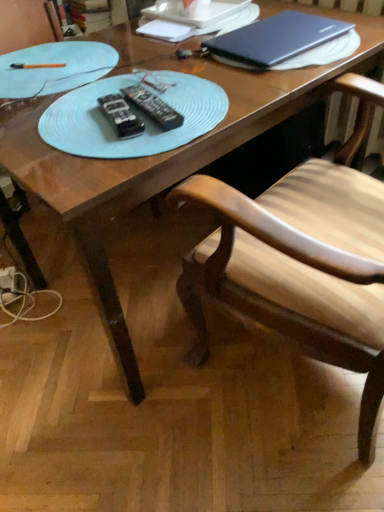
You are a GUI agent. You are given a task and a screenshot of the screen. Output one action in this format:
    pyautogui.click(x=<x>, y=<y>)
    Task: Click on the vacant region to the left of black plastic remote at center, the first remote in the right-to-left sequence
    This screenshot has height=512, width=384.
    Given the screenshot: What is the action you would take?
    59,123